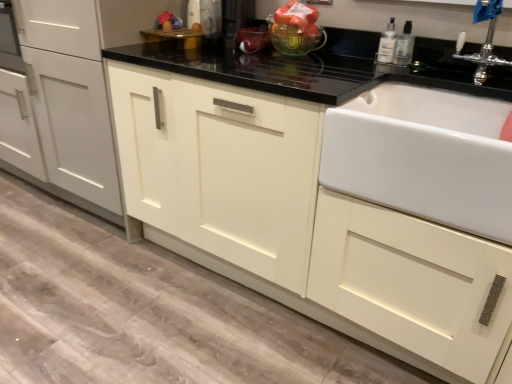
Question: From the image's perspective, is translucent glass bowl at upper center beneath white ceramic sink at right?

Choices:
 (A) yes
 (B) no

Answer: (B)

Question: From a real-world perspective, is translucent glass bowl at upper center below white ceramic sink at right?

Choices:
 (A) no
 (B) yes

Answer: (A)

Question: Is translucent glass bowl at upper center taller than white ceramic sink at right?

Choices:
 (A) yes
 (B) no

Answer: (B)

Question: From a real-world perspective, is translucent glass bowl at upper center on top of white ceramic sink at right?

Choices:
 (A) no
 (B) yes

Answer: (B)

Question: Are translucent glass bowl at upper center and white ceramic sink at right far apart?

Choices:
 (A) no
 (B) yes

Answer: (A)

Question: From the image's perspective, is translucent glass bowl at upper center on top of white ceramic sink at right?

Choices:
 (A) no
 (B) yes

Answer: (B)

Question: From the image's perspective, does clear plastic bottle at upper right, the second bottle when ordered from right to left, appear higher than translucent glass bowl at upper center?

Choices:
 (A) yes
 (B) no

Answer: (B)

Question: Considering the relative sizes of clear plastic bottle at upper right, positioned as the 1th bottle in left-to-right order, and translucent glass bowl at upper center in the image provided, is clear plastic bottle at upper right, positioned as the 1th bottle in left-to-right order, thinner than translucent glass bowl at upper center?

Choices:
 (A) no
 (B) yes

Answer: (B)

Question: Is clear plastic bottle at upper right, positioned as the 1th bottle in left-to-right order, smaller than translucent glass bowl at upper center?

Choices:
 (A) no
 (B) yes

Answer: (B)

Question: Is clear plastic bottle at upper right, the second bottle when ordered from right to left, next to translucent glass bowl at upper center?

Choices:
 (A) yes
 (B) no

Answer: (B)

Question: Can you confirm if clear plastic bottle at upper right, positioned as the 1th bottle in left-to-right order, is wider than translucent glass bowl at upper center?

Choices:
 (A) no
 (B) yes

Answer: (A)

Question: Does clear plastic bottle at upper right, the second bottle when ordered from right to left, have a larger size compared to translucent glass bowl at upper center?

Choices:
 (A) no
 (B) yes

Answer: (A)

Question: Considering the relative sizes of clear plastic bottle at upper right, which is the second bottle from left to right, and translucent glass bowl at upper center in the image provided, is clear plastic bottle at upper right, which is the second bottle from left to right, taller than translucent glass bowl at upper center?

Choices:
 (A) no
 (B) yes

Answer: (A)